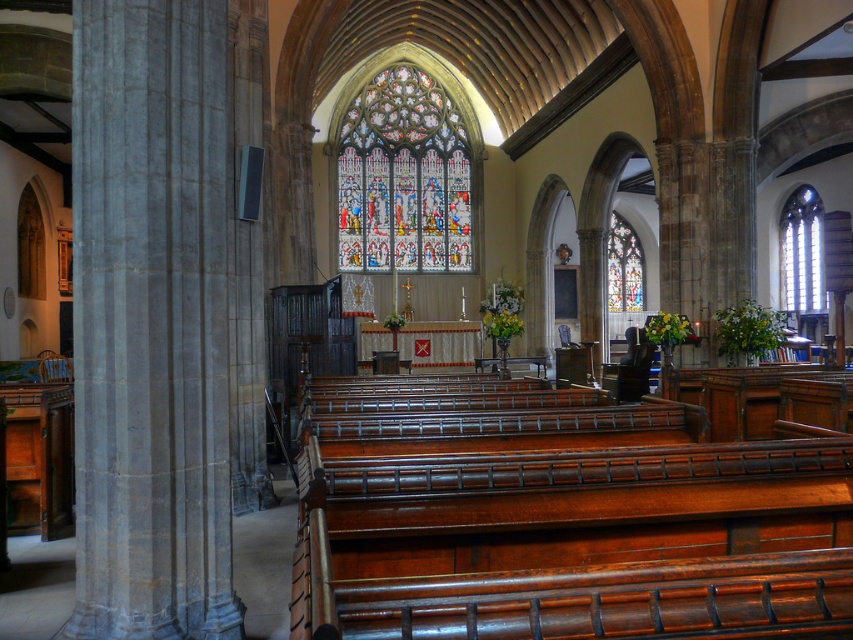
Question: Is stained glass at center smaller than clear glass window at right?

Choices:
 (A) yes
 (B) no

Answer: (B)

Question: Which point is closer to the camera?

Choices:
 (A) (397, 136)
 (B) (198, 196)
 (C) (608, 241)

Answer: (B)

Question: Which of the following is the closest to the observer?

Choices:
 (A) gray stone column at left
 (B) stained glass window at center

Answer: (A)

Question: Is stained glass at center closer to the viewer compared to stained glass window at center?

Choices:
 (A) no
 (B) yes

Answer: (A)

Question: Does stained glass at center appear over clear glass window at right?

Choices:
 (A) yes
 (B) no

Answer: (A)

Question: Which point is farther to the camera?

Choices:
 (A) stained glass window at center
 (B) gray stone column at left
 (C) clear glass window at right
 (D) stained glass at center

Answer: (D)